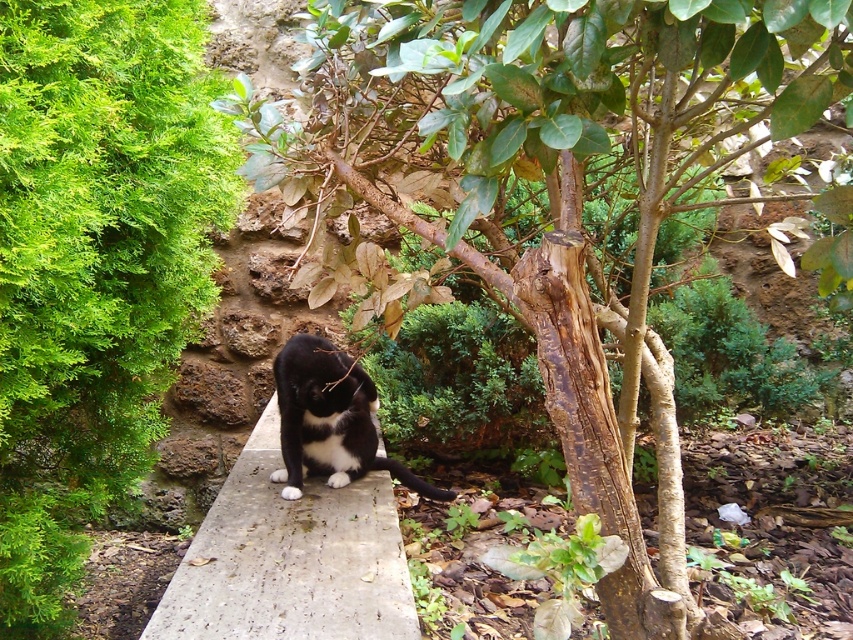
Question: Which object is farther from the camera taking this photo?

Choices:
 (A) green leafy bush at left
 (B) concrete at center

Answer: (B)

Question: Which point is closer to the camera taking this photo?

Choices:
 (A) (370, 436)
 (B) (286, 621)

Answer: (B)

Question: Does green leafy bush at left come in front of black fur cat at center?

Choices:
 (A) yes
 (B) no

Answer: (A)

Question: In this image, where is concrete at center located relative to black fur cat at center?

Choices:
 (A) below
 (B) above

Answer: (A)

Question: Among these points, which one is farthest from the camera?

Choices:
 (A) (256, 449)
 (B) (73, 500)
 (C) (312, 422)

Answer: (A)

Question: Does concrete at center have a smaller size compared to black fur cat at center?

Choices:
 (A) yes
 (B) no

Answer: (B)